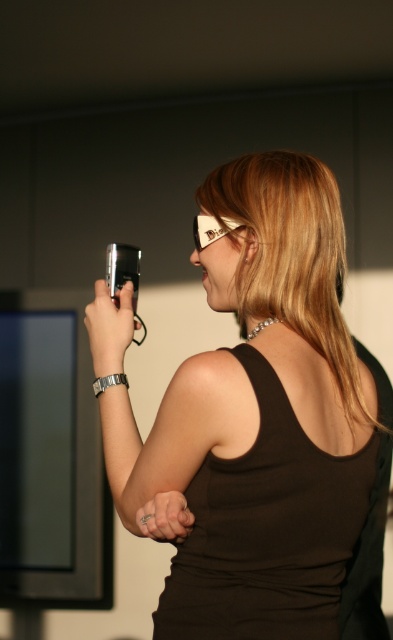
You are a photographer trying to capture the perfect shot. You notice the black matte tank top at back and the white plastic goggles at upper center in your frame. Given their distance apart, can you estimate if they will both fit within a standard smartphone camera frame that has a 60 cm width field of view?

The black matte tank top at back and white plastic goggles at upper center are 58.12 centimeters apart, which is less than the 60 cm width field of view of a standard smartphone camera. Therefore, both objects will fit within the frame.

You are a photographer trying to capture the black plastic game controller at upper left and the white plastic goggles at upper center in your shot. Based on their positions, which object should you focus on first if you want to include both in the frame?

The black plastic game controller at upper left is positioned under the white plastic goggles at upper center, so you should focus on the white plastic goggles at upper center first to ensure both are in the frame.

You are a fashion stylist analyzing a photo. You notice the black matte tank top at back and the silver metallic ring at center. Which item is positioned lower on the person?

The black matte tank top at back is positioned lower on the person because it is below the silver metallic ring at center.